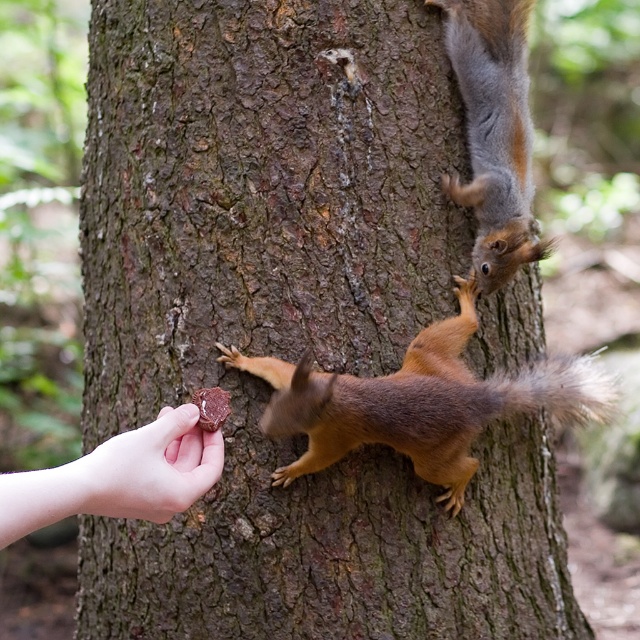
Question: From the image, what is the correct spatial relationship of shiny brown fur at upper right in relation to smooth skin hand at lower left?

Choices:
 (A) below
 (B) above

Answer: (B)

Question: Is shiny brown fur at upper right positioned at the back of fuzzy brown tail at center?

Choices:
 (A) no
 (B) yes

Answer: (B)

Question: Considering the relative positions of brown furry squirrel at lower center and brown matte food at lower left in the image provided, where is brown furry squirrel at lower center located with respect to brown matte food at lower left?

Choices:
 (A) above
 (B) below

Answer: (B)

Question: Which of the following is the closest to the observer?

Choices:
 (A) (177, 424)
 (B) (572, 356)
 (C) (460, 502)

Answer: (A)

Question: Which object is the farthest from the fuzzy brown tail at center?

Choices:
 (A) shiny brown fur at upper right
 (B) smooth skin hand at lower left

Answer: (B)

Question: Which of the following is the closest to the observer?

Choices:
 (A) shiny brown fur at upper right
 (B) smooth skin hand at lower left

Answer: (B)